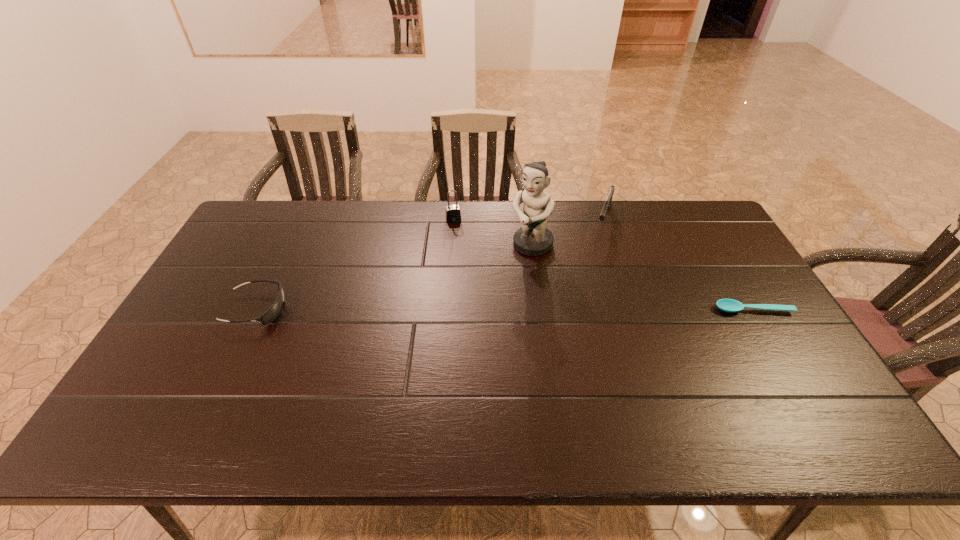
You are a GUI agent. You are given a task and a screenshot of the screen. Output one action in this format:
    pyautogui.click(x=<x>, y=<y>)
    Task: Click on the vacant space at the far left corner of the desktop
    This screenshot has width=960, height=540.
    Given the screenshot: What is the action you would take?
    pyautogui.click(x=257, y=238)

This screenshot has width=960, height=540. What are the coordinates of `vacant area between the second object from left to right and the spoon` in the screenshot? It's located at (603, 264).

Where is `unoccupied position between the rightmost object and the second object from left to right`? unoccupied position between the rightmost object and the second object from left to right is located at coordinates (603, 264).

Find the location of a particular element. empty location between the spoon and the goggles is located at coordinates (505, 309).

I want to click on free space between the goggles and the spoon, so click(505, 309).

Find the location of a particular element. The width and height of the screenshot is (960, 540). unoccupied area between the leftmost object and the gun is located at coordinates (430, 263).

This screenshot has width=960, height=540. I want to click on vacant point located between the padlock and the shortest object, so click(x=603, y=264).

At what (x,y) coordinates should I click in order to perform the action: click on empty location between the tallest object and the fourth object from left to right. Please return your answer as a coordinate pair (x, y). Looking at the image, I should click on (567, 231).

This screenshot has height=540, width=960. I want to click on free space between the third object from right to left and the shortest object, so click(x=642, y=277).

The width and height of the screenshot is (960, 540). Identify the location of free space between the spoon and the tallest object. (642, 277).